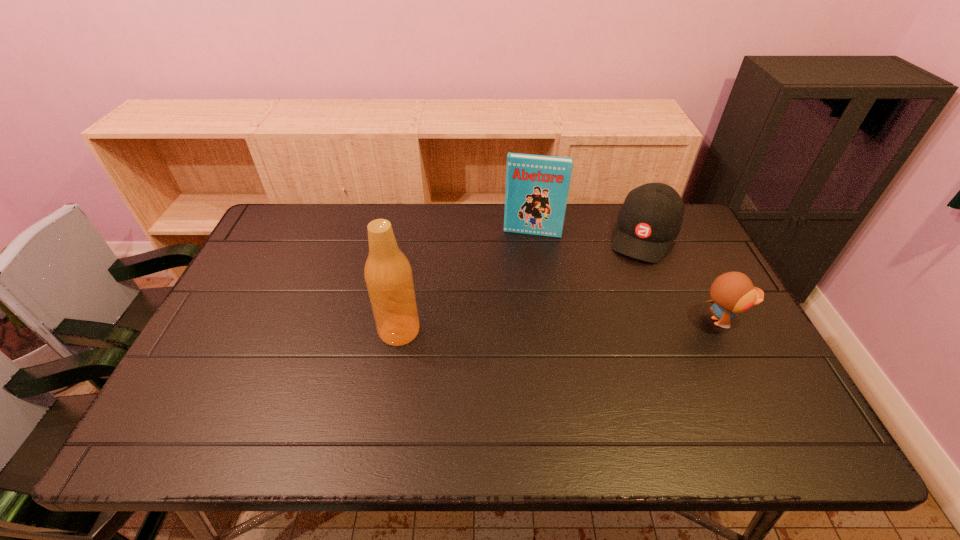
At what (x,y) coordinates should I click in order to perform the action: click on vacant area between the third object from right to left and the tallest object. Please return your answer as a coordinate pair (x, y). The height and width of the screenshot is (540, 960). Looking at the image, I should click on (466, 281).

Locate an element on the screen. vacant area that lies between the baseball cap and the book is located at coordinates (588, 234).

This screenshot has width=960, height=540. Identify the location of object identified as the third closest to the book. (733, 292).

You are a GUI agent. You are given a task and a screenshot of the screen. Output one action in this format:
    pyautogui.click(x=<x>, y=<y>)
    Task: Click on the second closest object to the second tallest object
    This screenshot has height=540, width=960.
    Given the screenshot: What is the action you would take?
    pyautogui.click(x=388, y=275)

I want to click on vacant area in the image that satisfies the following two spatial constraints: 1. on the front side of the duck; 2. on the front-facing side of the baseball cap, so click(682, 321).

At what (x,y) coordinates should I click in order to perform the action: click on free spot that satisfies the following two spatial constraints: 1. on the front side of the duck; 2. on the front-facing side of the baseball cap. Please return your answer as a coordinate pair (x, y). This screenshot has width=960, height=540. Looking at the image, I should click on (682, 321).

This screenshot has width=960, height=540. I want to click on vacant region that satisfies the following two spatial constraints: 1. on the front side of the third shortest object; 2. on the front-facing side of the duck, so click(x=544, y=321).

The height and width of the screenshot is (540, 960). In order to click on vacant area that satisfies the following two spatial constraints: 1. on the front side of the book; 2. on the front-facing side of the duck in this screenshot , I will do `click(544, 321)`.

The height and width of the screenshot is (540, 960). In order to click on vacant region that satisfies the following two spatial constraints: 1. on the front side of the third shortest object; 2. on the front-facing side of the duck in this screenshot , I will do `click(544, 321)`.